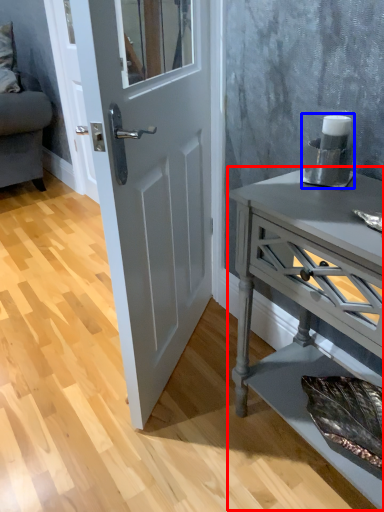
Question: Which object is closer to the camera taking this photo, nightstand (highlighted by a red box) or appliance (highlighted by a blue box)?

Choices:
 (A) nightstand
 (B) appliance

Answer: (A)